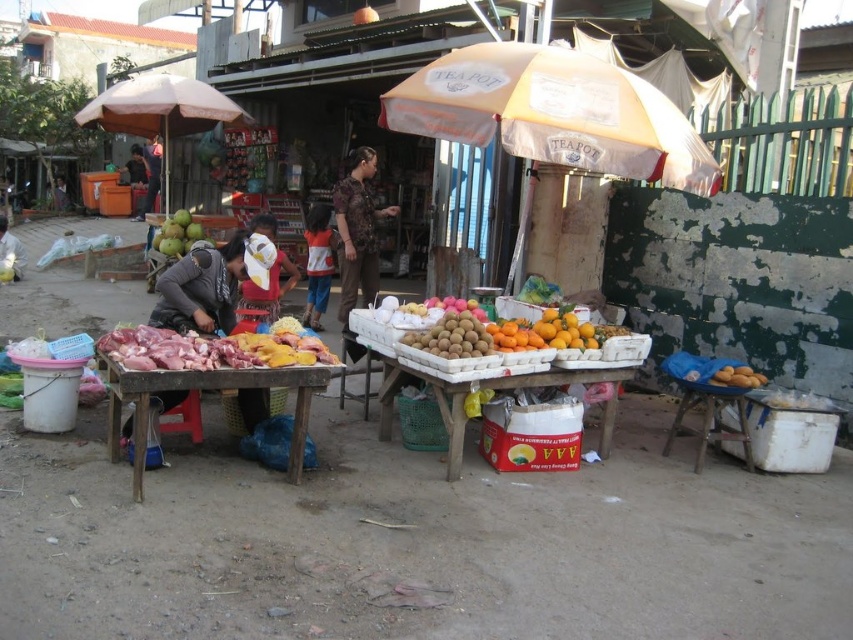
Consider the image. Which of these two, wooden table at lower left or matte gray jacket at center, stands shorter?

With less height is wooden table at lower left.

Is wooden table at lower left smaller than matte gray jacket at center?

Actually, wooden table at lower left might be larger than matte gray jacket at center.

Is point (112, 403) positioned in front of point (196, 292)?

Yes.

This screenshot has width=853, height=640. What are the coordinates of `wooden table at lower left` in the screenshot? It's located at (207, 388).

Which is in front, point (144, 410) or point (566, 384)?

Point (144, 410)

Which is in front, point (299, 481) or point (454, 445)?

Point (299, 481) is in front.

This screenshot has height=640, width=853. Identify the location of wooden table at lower left. pos(207,388).

Is orange fabric umbrella at center further to the viewer compared to wooden table at lower left?

Yes, orange fabric umbrella at center is behind wooden table at lower left.

This screenshot has width=853, height=640. What do you see at coordinates (553, 113) in the screenshot?
I see `orange fabric umbrella at center` at bounding box center [553, 113].

Is point (413, 115) positioned behind point (264, 384)?

Yes, point (413, 115) is behind point (264, 384).

The image size is (853, 640). I want to click on orange fabric umbrella at center, so click(x=553, y=113).